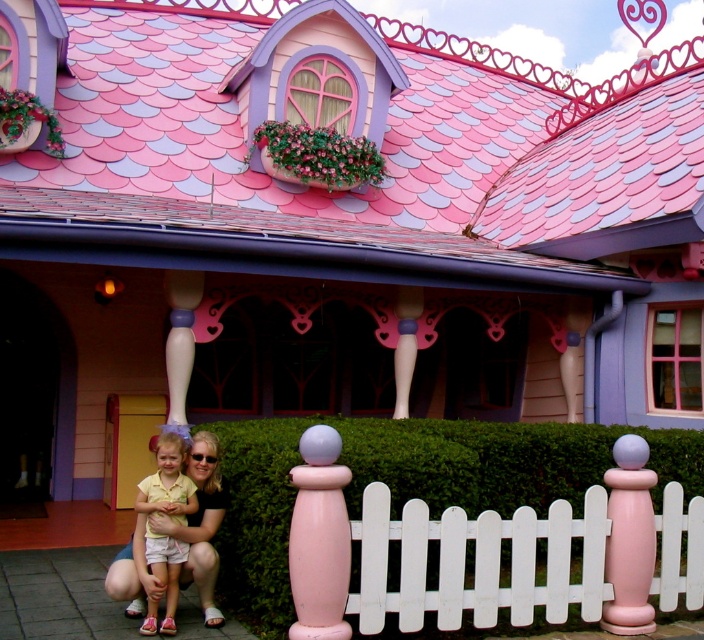
You are standing in front of the fairy tale house and want to walk to the yellow door. Which direction should you walk relative to the white picket fence at center?

Since the white picket fence at center is located at point (479, 563), you should walk towards the lower left direction to reach the yellow door.

You are standing in front of the fairy tale house and want to see if you can walk through the gap between the green hedge at center and the white picket fence at center. Considering the height of both, will you be able to walk through without bending down?

The green hedge at center is shorter than the white picket fence at center. Since the hedge is shorter, the gap between them might be lower than the fence height. However, the question is about walking through without bending down. Since the hedge is shorter, the lowest point of the gap would be determined by the hedge height. If the hedge is low enough, you can walk through without bending. But since the hedge is shorter than the fence, the fence might have a higher top, but the walking height is usually 1

You are standing in front of the fairy tale house and see two points marked on the ground. The first point is at coordinate point [653,451] and the second point is at coordinate point [170,452]. If you were to walk from the first point to the second point, would you be moving towards the house or away from it?

Since point [653,451] is behind point [170,452], walking from the first point to the second point would mean moving towards the house.